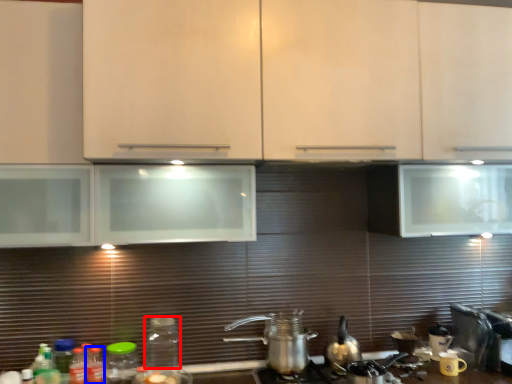
Question: Which point is closer to the camera, bottle (highlighted by a red box) or bottle (highlighted by a blue box)?

Choices:
 (A) bottle
 (B) bottle

Answer: (A)